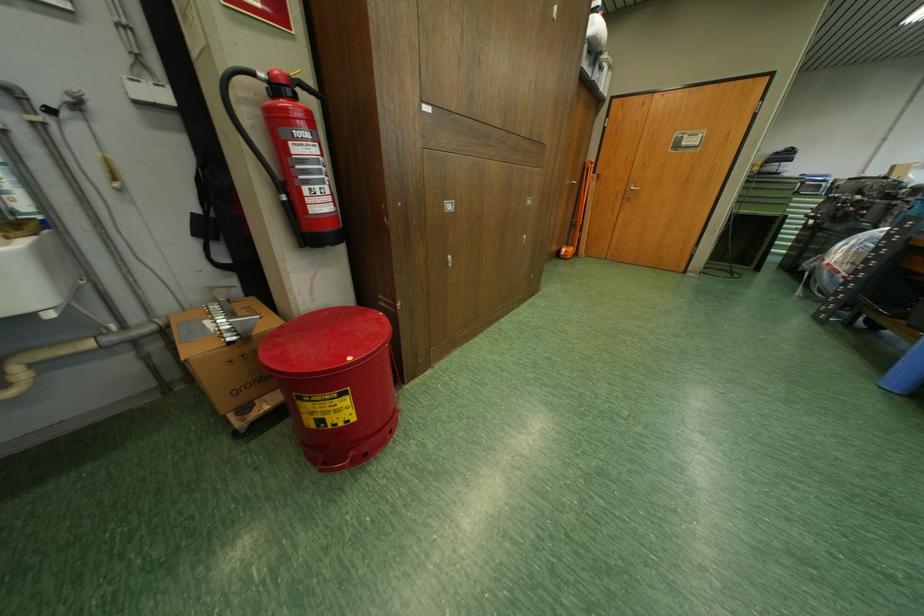
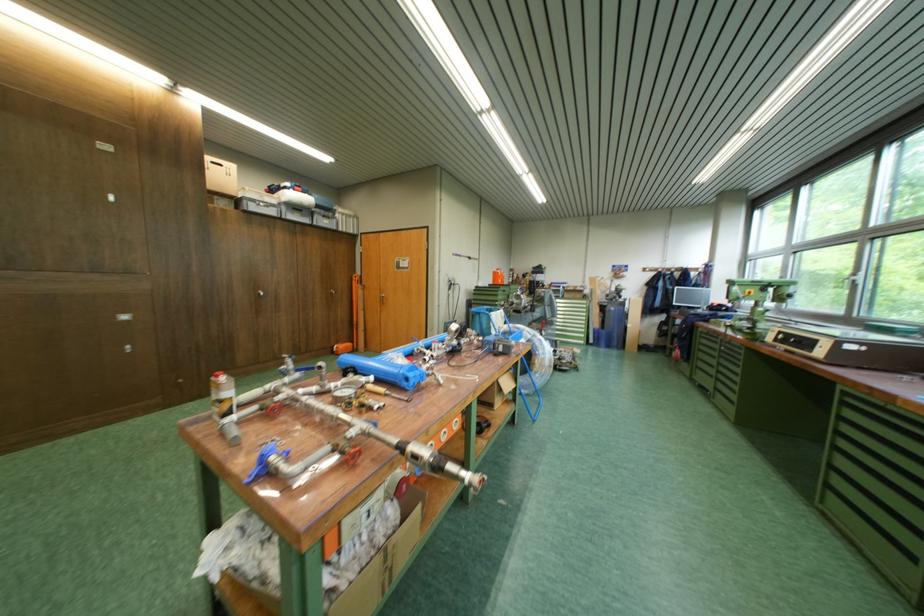
Locate, in the second image, the point that corresponds to (x=576, y=254) in the first image.

(347, 350)